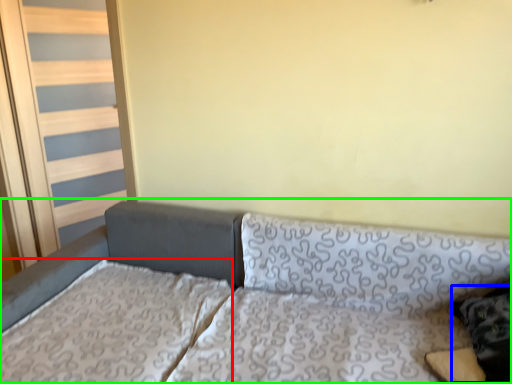
Question: Which is farther away from mattress (highlighted by a red box)? pillow (highlighted by a blue box) or studio couch (highlighted by a green box)?

Choices:
 (A) pillow
 (B) studio couch

Answer: (A)